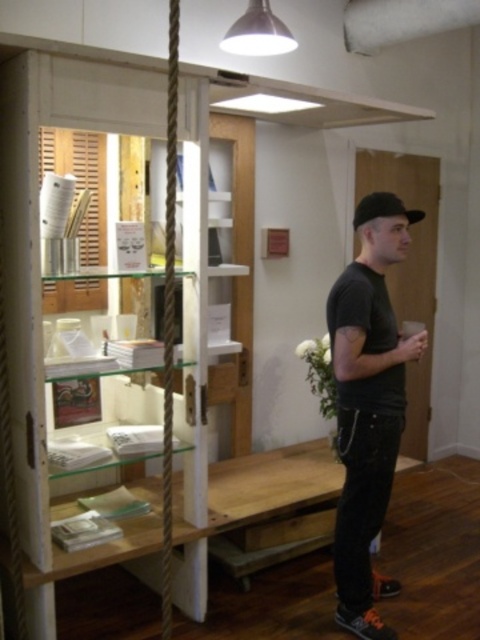
You are an interior designer planning to place a large decorative item on the clear glass shelves at center and a smaller one on the metallic silver lampshade at upper center. Based on the scene, which object can accommodate the larger decorative item?

The clear glass shelves at center can accommodate the larger decorative item because it is bigger than the metallic silver lampshade at upper center.